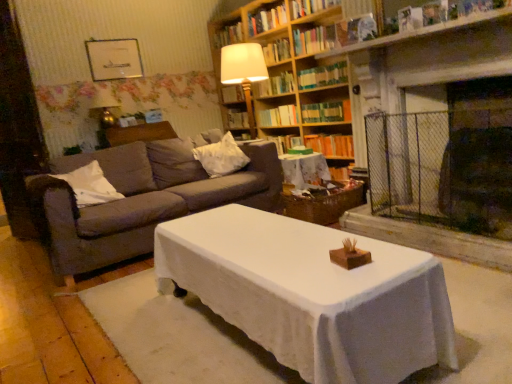
Question: Can you confirm if orange hardcover book at center, the 10th book when ordered from top to bottom, is taller than white soft pillow at left, acting as the first pillow starting from the left?

Choices:
 (A) yes
 (B) no

Answer: (B)

Question: From a real-world perspective, is orange hardcover book at center, the 10th book when ordered from top to bottom, positioned over white soft pillow at left, acting as the first pillow starting from the left, based on gravity?

Choices:
 (A) no
 (B) yes

Answer: (A)

Question: From a real-world perspective, does orange hardcover book at center, the 10th book when ordered from top to bottom, sit lower than white soft pillow at left, which ranks as the second pillow in right-to-left order?

Choices:
 (A) yes
 (B) no

Answer: (A)

Question: Is white soft pillow at left, acting as the first pillow starting from the left, surrounded by orange hardcover book at center, the 10th book when ordered from top to bottom?

Choices:
 (A) yes
 (B) no

Answer: (B)

Question: Does orange hardcover book at center, arranged as the first book when ordered from the bottom, appear on the left side of white soft pillow at left, positioned as the second pillow in back-to-front order?

Choices:
 (A) no
 (B) yes

Answer: (A)

Question: Can you confirm if orange hardcover book at center, arranged as the first book when ordered from the bottom, is smaller than white soft pillow at left, which ranks as the second pillow in right-to-left order?

Choices:
 (A) no
 (B) yes

Answer: (B)

Question: Is hardcover book at upper center, the 10th book positioned from the bottom, to the right of metallic silver picture frame at upper center from the viewer's perspective?

Choices:
 (A) no
 (B) yes

Answer: (B)

Question: Is hardcover book at upper center, the 10th book positioned from the bottom, further to camera compared to metallic silver picture frame at upper center?

Choices:
 (A) yes
 (B) no

Answer: (A)

Question: From a real-world perspective, is hardcover book at upper center, the 10th book positioned from the bottom, below metallic silver picture frame at upper center?

Choices:
 (A) yes
 (B) no

Answer: (B)

Question: Can you confirm if hardcover book at upper center, the 10th book positioned from the bottom, is bigger than metallic silver picture frame at upper center?

Choices:
 (A) no
 (B) yes

Answer: (B)

Question: Is hardcover book at upper center, the 1th book from the top, to the left of metallic silver picture frame at upper center from the viewer's perspective?

Choices:
 (A) yes
 (B) no

Answer: (B)

Question: Are hardcover book at upper center, the 1th book from the top, and metallic silver picture frame at upper center beside each other?

Choices:
 (A) no
 (B) yes

Answer: (A)

Question: Is white soft pillow at left, acting as the first pillow starting from the left, a part of hardcover book at center, positioned as the 4th book in bottom-to-top order?

Choices:
 (A) yes
 (B) no

Answer: (B)